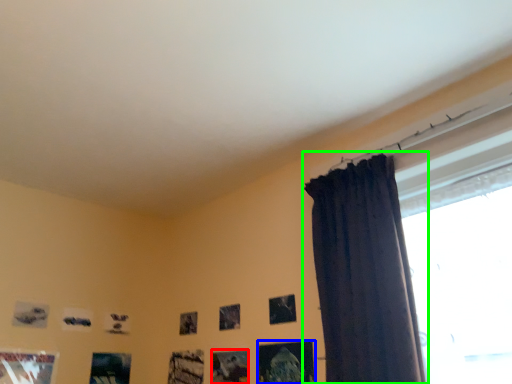
Question: Which is farther away from picture frame (highlighted by a red box)? picture frame (highlighted by a blue box) or curtain (highlighted by a green box)?

Choices:
 (A) picture frame
 (B) curtain

Answer: (B)